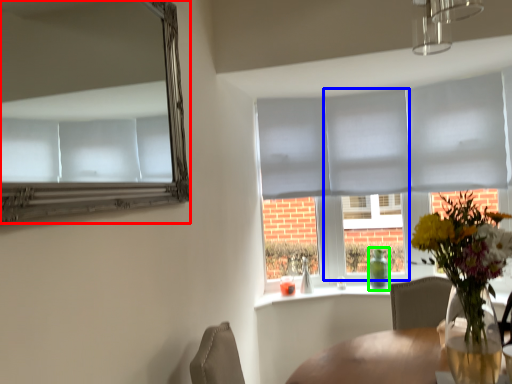
Question: Estimate the real-world distances between objects in this image. Which object is closer to mirror (highlighted by a red box), glass door (highlighted by a blue box) or bottle (highlighted by a green box)?

Choices:
 (A) glass door
 (B) bottle

Answer: (A)